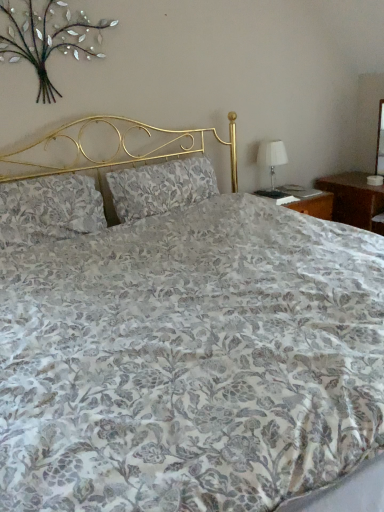
Question: Considering the positions of metallic silver floral arrangement at upper left and white fabric table lamp at right in the image, is metallic silver floral arrangement at upper left bigger or smaller than white fabric table lamp at right?

Choices:
 (A) small
 (B) big

Answer: (A)

Question: Considering the relative positions of metallic silver floral arrangement at upper left and white fabric table lamp at right in the image provided, is metallic silver floral arrangement at upper left to the left or to the right of white fabric table lamp at right?

Choices:
 (A) right
 (B) left

Answer: (B)

Question: Estimate the real-world distances between objects in this image. Which object is closer to the floral fabric pillow at center, acting as the second pillow starting from the left?

Choices:
 (A) metallic silver floral arrangement at upper left
 (B) white fabric table lamp at right
 (C) floral fabric pillow at left, which is the first pillow in left-to-right order

Answer: (C)

Question: Estimate the real-world distances between objects in this image. Which object is farther from the floral fabric pillow at center, acting as the second pillow starting from the left?

Choices:
 (A) white fabric table lamp at right
 (B) metallic silver floral arrangement at upper left
 (C) floral fabric pillow at left, positioned as the second pillow in right-to-left order

Answer: (A)